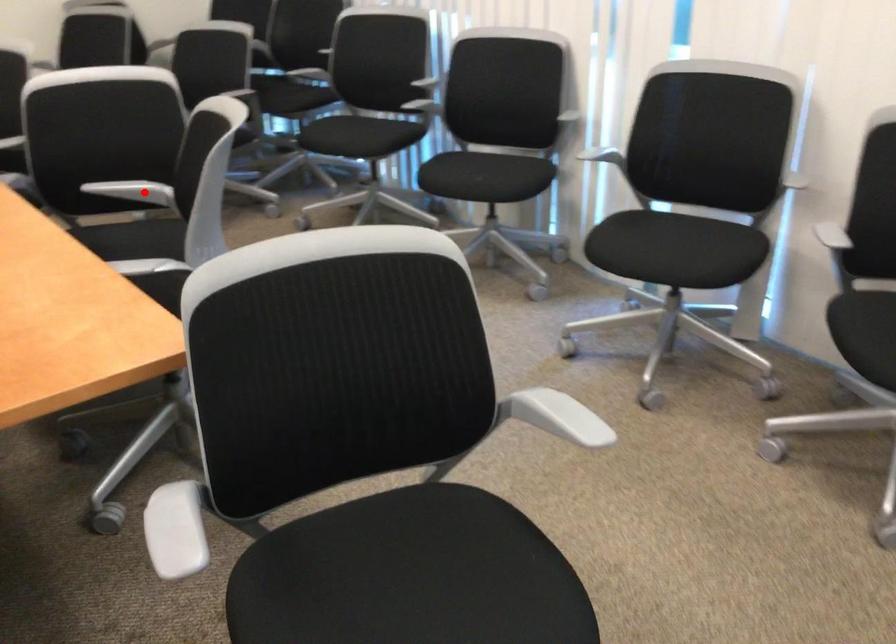
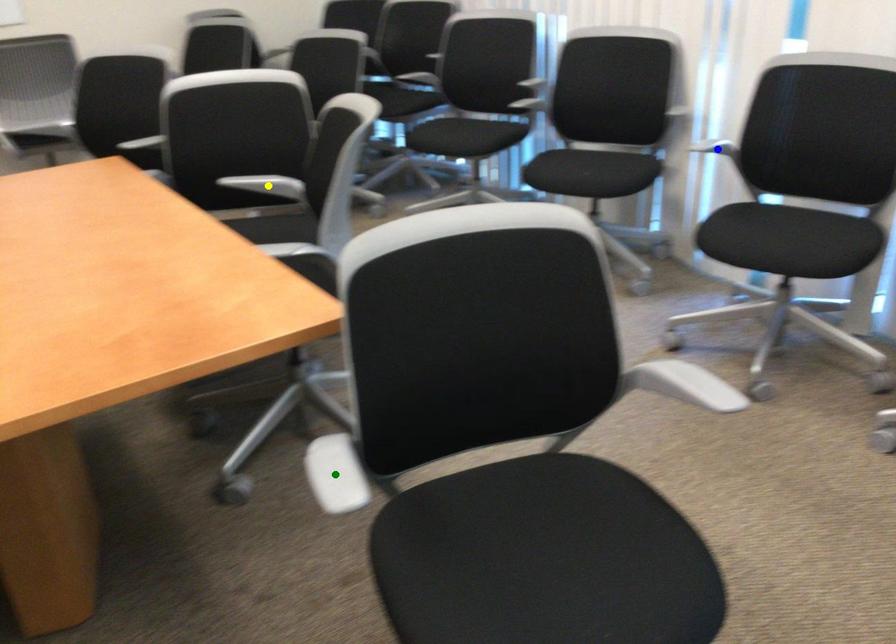
Question: I am providing you with two images of the same scene from different viewpoints. A red point is marked on the first image. You are given multiple points on the second image. Can you choose the point in image 2 that corresponds to the point in image 1?

Choices:
 (A) yellow point
 (B) blue point
 (C) green point

Answer: (A)